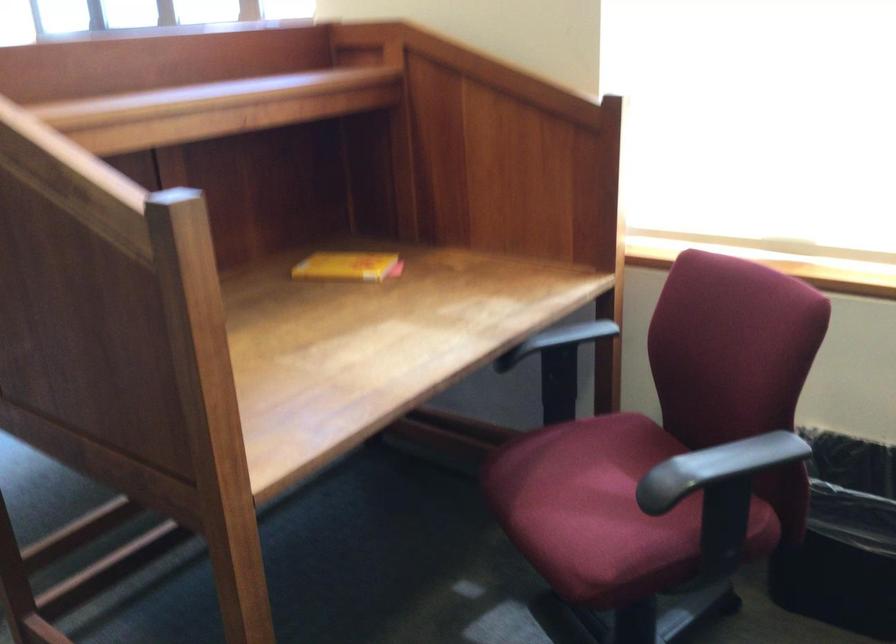
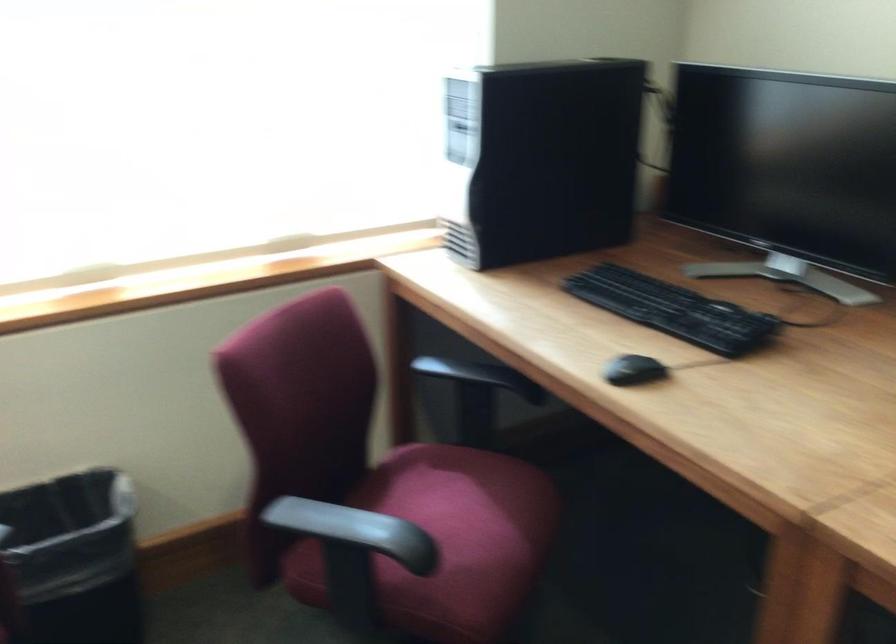
Question: Based on the continuous images, in which direction is the camera rotating? Reply with the corresponding letter.

Choices:
 (A) Left
 (B) Right
 (C) Up
 (D) Down

Answer: (B)